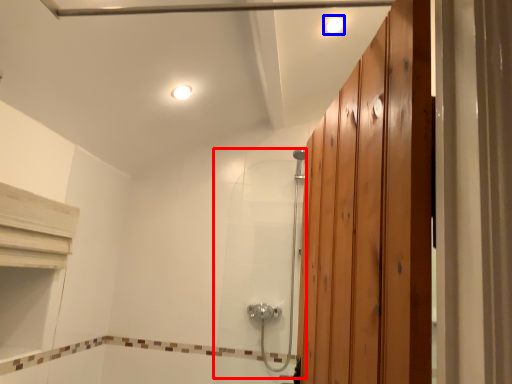
Question: Which object appears farthest to the camera in this image, shower door (highlighted by a red box) or light fixture (highlighted by a blue box)?

Choices:
 (A) shower door
 (B) light fixture

Answer: (A)